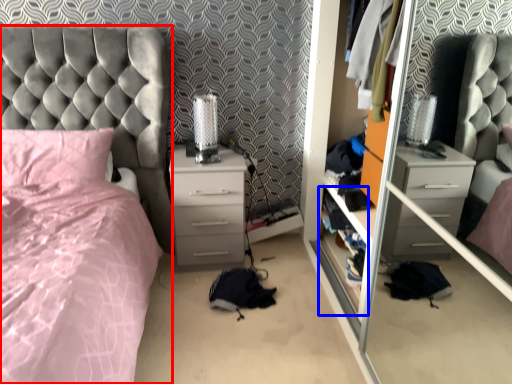
Question: Which object is closer to the camera taking this photo, bed (highlighted by a red box) or shelf (highlighted by a blue box)?

Choices:
 (A) bed
 (B) shelf

Answer: (A)